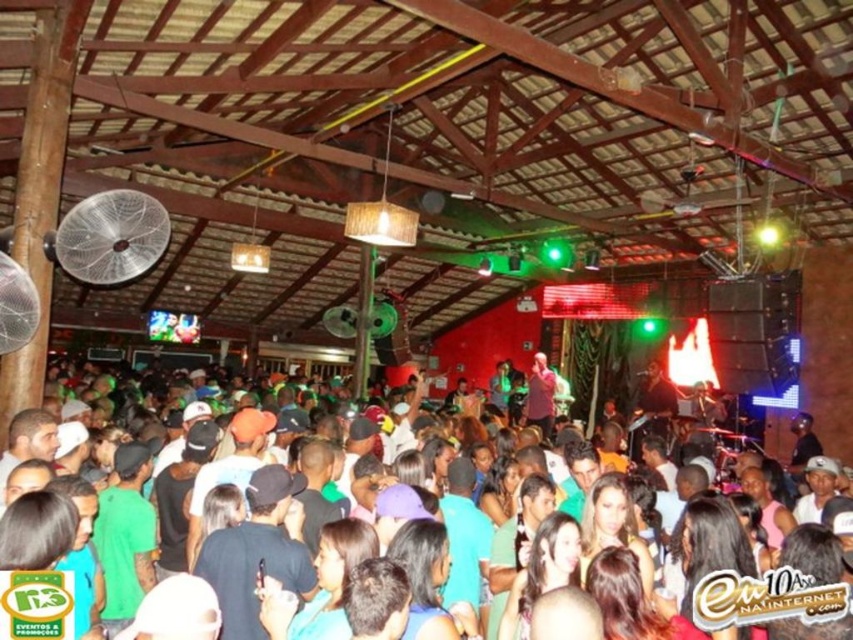
Question: Is white plastic fan at upper left to the left of white mesh fan at left from the viewer's perspective?

Choices:
 (A) yes
 (B) no

Answer: (A)

Question: Does matte black crowd at center have a greater width compared to white mesh fan at left?

Choices:
 (A) yes
 (B) no

Answer: (A)

Question: Among these objects, which one is nearest to the camera?

Choices:
 (A) matte black crowd at center
 (B) white plastic fan at upper left

Answer: (A)

Question: Which of these objects is positioned closest to the white mesh fan at left?

Choices:
 (A) white plastic fan at upper left
 (B) matte black crowd at center

Answer: (A)

Question: Can you confirm if matte black crowd at center is positioned above white plastic fan at upper left?

Choices:
 (A) no
 (B) yes

Answer: (A)

Question: Which point is farther to the camera?

Choices:
 (A) white mesh fan at left
 (B) matte black crowd at center
 (C) white plastic fan at upper left

Answer: (C)